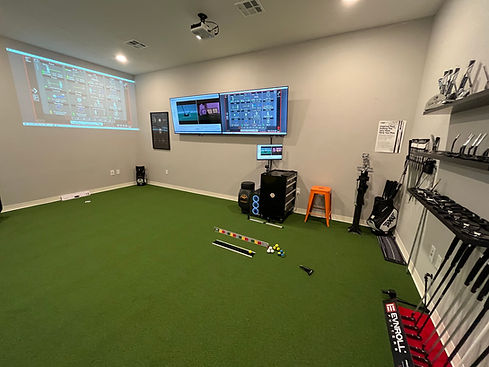
Locate an element on the screen. orange stool is located at coordinates (320, 197).